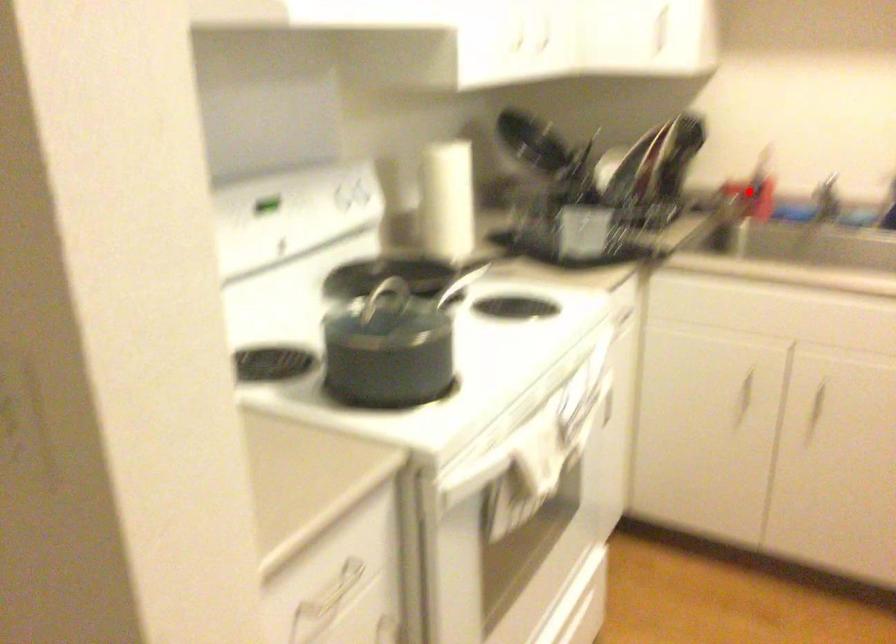
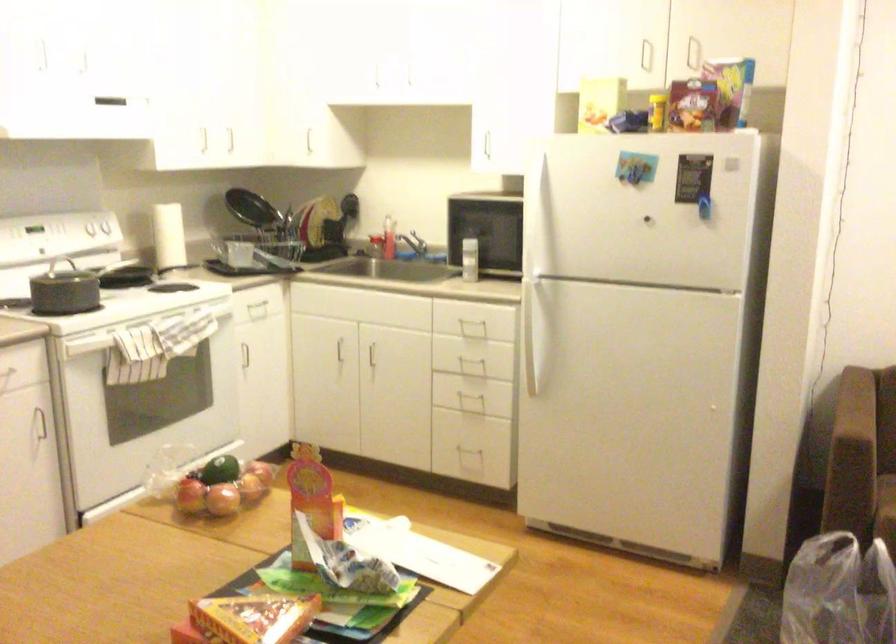
The point at the highlighted location is marked in the first image. Where is the corresponding point in the second image?

(403, 247)